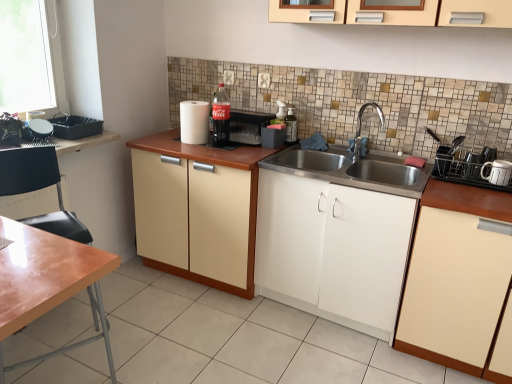
Find the location of a particular element. The image size is (512, 384). vacant area in front of matte glass bottle at center, the first bottle viewed from the left is located at coordinates (207, 152).